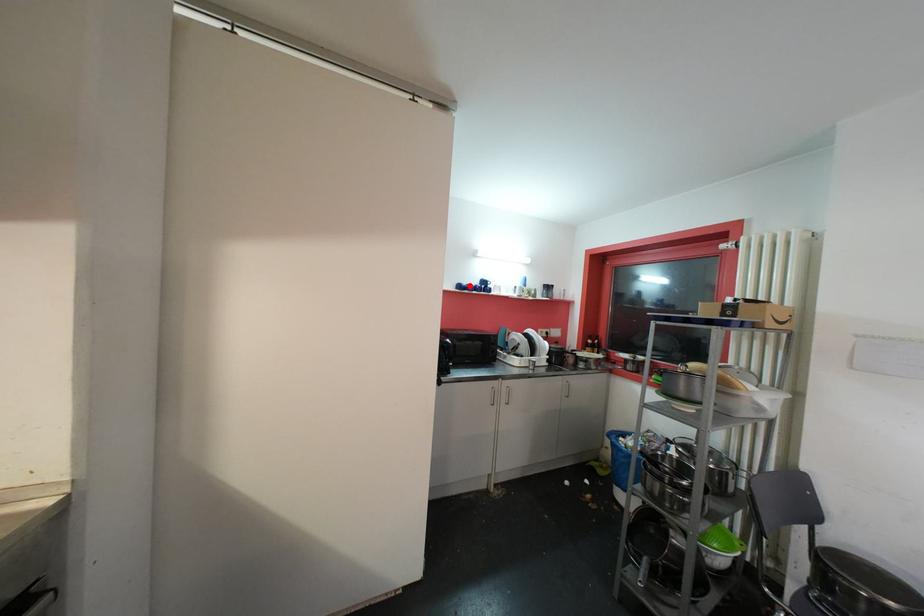
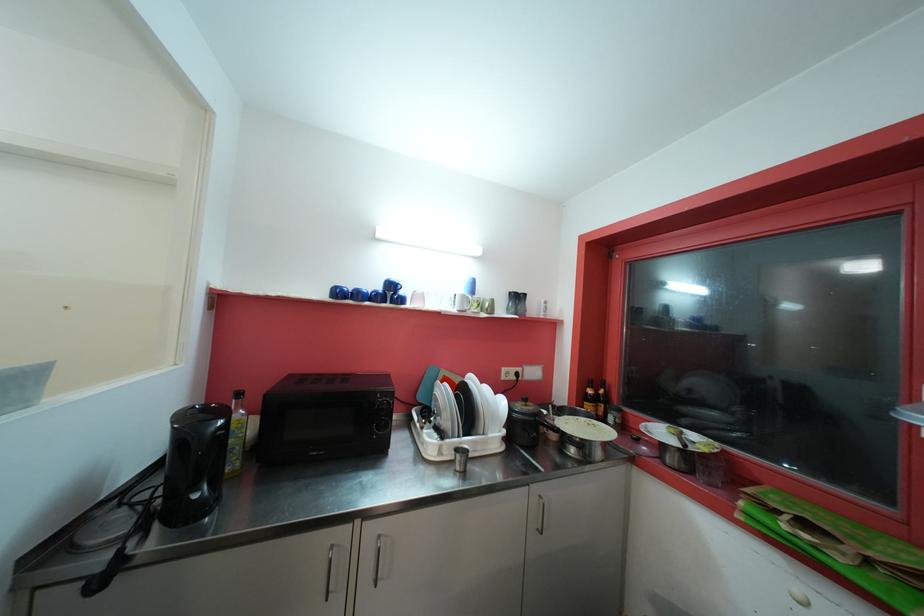
Question: I am providing you with two images of the same scene from different viewpoints. A red point is marked on the first image. At the location where the point appears in image 1, is it still visible in image 2?

Choices:
 (A) Yes
 (B) No

Answer: (A)